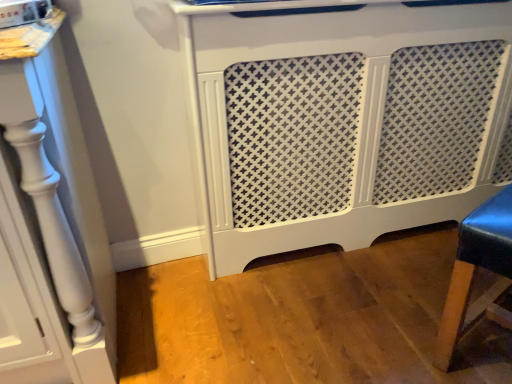
At what (x,y) coordinates should I click in order to perform the action: click on white plastic radiator at center. Please return your answer as a coordinate pair (x, y). Image resolution: width=512 pixels, height=384 pixels. Looking at the image, I should click on (349, 123).

The height and width of the screenshot is (384, 512). Describe the element at coordinates (349, 123) in the screenshot. I see `white plastic radiator at center` at that location.

I want to click on white plastic radiator at center, so point(349,123).